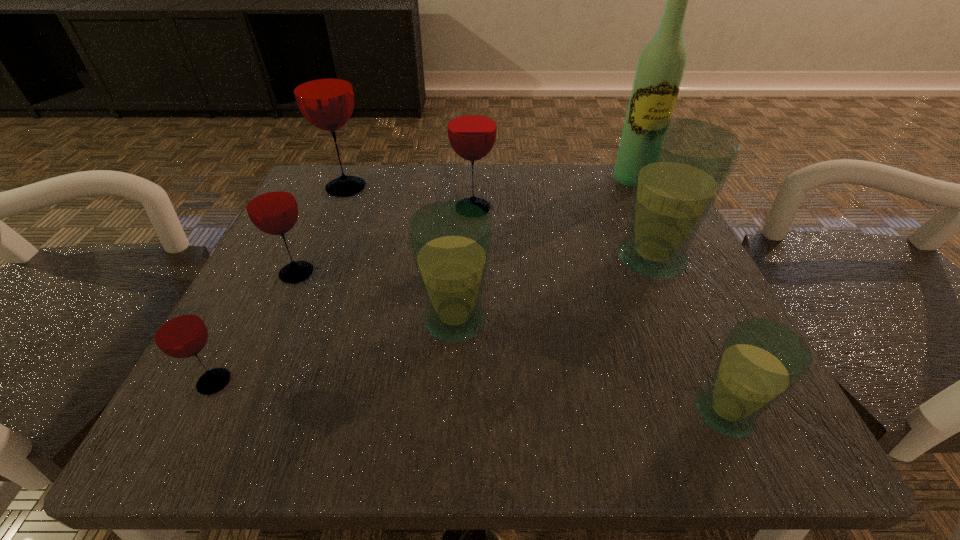
Where is `white wine bottle`? This screenshot has width=960, height=540. white wine bottle is located at coordinates (659, 73).

This screenshot has height=540, width=960. Identify the location of the tallest object. (659, 73).

Locate an element on the screen. the tallest glass is located at coordinates (322, 87).

Find the location of `the seventh shortest object`. the seventh shortest object is located at coordinates pos(322,87).

Find the location of a particular element. This screenshot has height=540, width=960. the third smallest red glass is located at coordinates (471, 120).

Find the location of a particular element. The image size is (960, 540). the biggest blue glass is located at coordinates (682, 166).

Locate an element on the screen. the second nearest red glass is located at coordinates (271, 206).

In order to click on the second nearest blue glass in this screenshot , I will do `click(450, 241)`.

Image resolution: width=960 pixels, height=540 pixels. What are the coordinates of `the second biggest blue glass` in the screenshot? It's located at (450, 241).

The width and height of the screenshot is (960, 540). I want to click on the smallest red glass, so [178, 331].